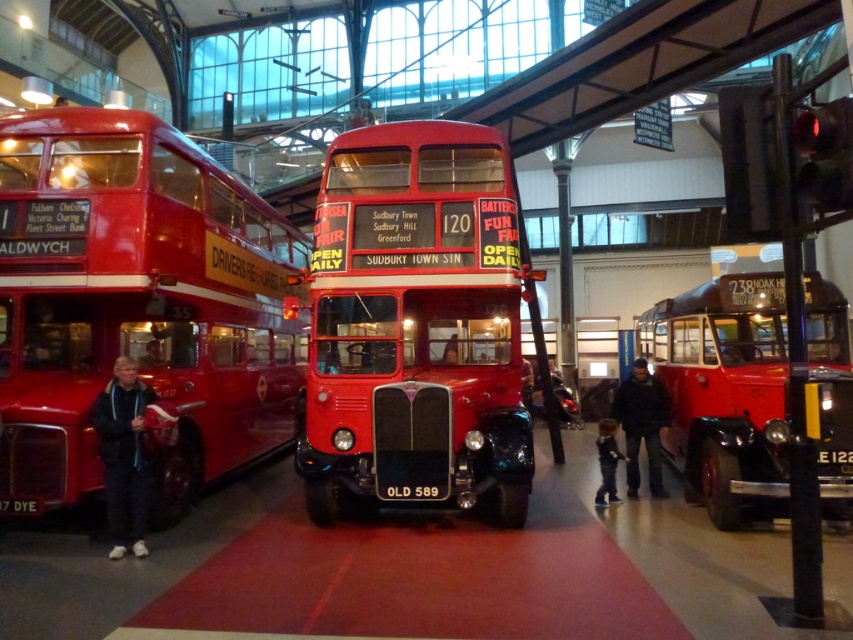
Can you confirm if shiny red bus at right is positioned to the left of dark blue fleece jacket at lower left?

Incorrect, shiny red bus at right is not on the left side of dark blue fleece jacket at lower left.

Does point (691, 403) lie in front of point (142, 548)?

No, (691, 403) is behind (142, 548).

In order to click on shiny red bus at right in this screenshot , I will do `click(723, 392)`.

Who is positioned more to the right, shiny red bus at center or black plastic license plate at center?

shiny red bus at center is more to the right.

Where is `shiny red bus at center`? This screenshot has width=853, height=640. shiny red bus at center is located at coordinates click(415, 323).

Between point (212, 460) and point (136, 424), which one is positioned behind?

Point (212, 460)

Does point (167, 451) come in front of point (109, 508)?

No, (167, 451) is behind (109, 508).

Is point (157, 202) positioned behind point (112, 419)?

Yes, it is behind point (112, 419).

The width and height of the screenshot is (853, 640). Identify the location of matte red double-decker bus at left. (136, 304).